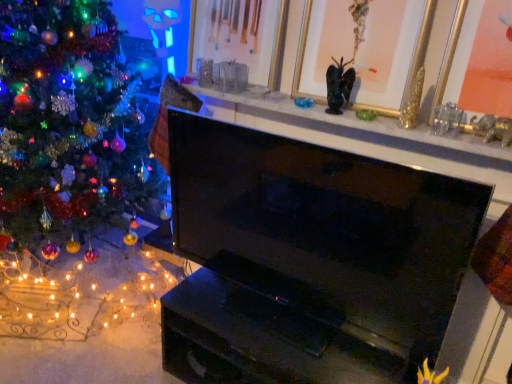
Question: Is gold-framed picture at upper center, positioned as the 1th picture frame in left-to-right order, completely or partially outside of matte black fireplace at upper center?

Choices:
 (A) no
 (B) yes

Answer: (B)

Question: From the image's perspective, is gold-framed picture at upper center, the 3th picture frame when ordered from right to left, located beneath matte black fireplace at upper center?

Choices:
 (A) no
 (B) yes

Answer: (A)

Question: From a real-world perspective, is gold-framed picture at upper center, positioned as the 1th picture frame in left-to-right order, on matte black fireplace at upper center?

Choices:
 (A) yes
 (B) no

Answer: (A)

Question: Is the depth of gold-framed picture at upper center, the 3th picture frame when ordered from right to left, less than that of matte black fireplace at upper center?

Choices:
 (A) no
 (B) yes

Answer: (A)

Question: Does gold-framed picture at upper center, positioned as the 1th picture frame in left-to-right order, turn towards matte black fireplace at upper center?

Choices:
 (A) yes
 (B) no

Answer: (B)

Question: Is black glossy tv at center taller or shorter than shiny multicolored ornaments at left?

Choices:
 (A) tall
 (B) short

Answer: (B)

Question: Considering the positions of black glossy tv at center and shiny multicolored ornaments at left in the image, is black glossy tv at center wider or thinner than shiny multicolored ornaments at left?

Choices:
 (A) wide
 (B) thin

Answer: (B)

Question: From the image's perspective, is black glossy tv at center above or below shiny multicolored ornaments at left?

Choices:
 (A) below
 (B) above

Answer: (A)

Question: Considering the positions of black glossy tv at center and shiny multicolored ornaments at left in the image, is black glossy tv at center bigger or smaller than shiny multicolored ornaments at left?

Choices:
 (A) big
 (B) small

Answer: (B)

Question: Considering the positions of black glossy tv at center and gold metallic picture frame at upper right, which appears as the first picture frame when viewed from the right, in the image, is black glossy tv at center taller or shorter than gold metallic picture frame at upper right, which appears as the first picture frame when viewed from the right,?

Choices:
 (A) short
 (B) tall

Answer: (B)

Question: Considering the positions of black glossy tv at center and gold metallic picture frame at upper right, the third picture frame positioned from the left, in the image, is black glossy tv at center wider or thinner than gold metallic picture frame at upper right, the third picture frame positioned from the left,?

Choices:
 (A) thin
 (B) wide

Answer: (A)

Question: Based on their sizes in the image, would you say black glossy tv at center is bigger or smaller than gold metallic picture frame at upper right, the third picture frame positioned from the left?

Choices:
 (A) big
 (B) small

Answer: (A)

Question: From the image's perspective, is black glossy tv at center located above or below gold metallic picture frame at upper right, which appears as the first picture frame when viewed from the right?

Choices:
 (A) below
 (B) above

Answer: (A)

Question: In the image, is gold/gilded picture frame at upper center, the 2th picture frame from the left, positioned in front of or behind shiny multicolored ornaments at left?

Choices:
 (A) behind
 (B) front

Answer: (A)

Question: Is point (396, 114) closer or farther from the camera than point (113, 109)?

Choices:
 (A) closer
 (B) farther

Answer: (A)